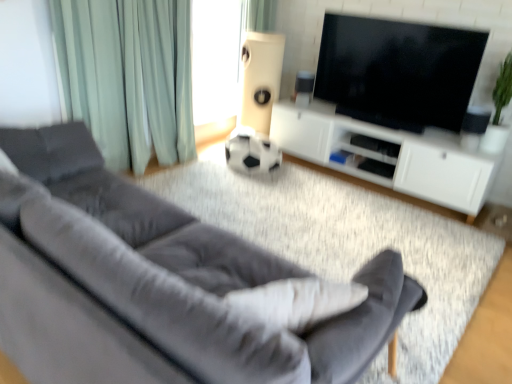
Image resolution: width=512 pixels, height=384 pixels. I want to click on free space between black glossy tv at upper center and white plastic speaker at upper center, arranged as the first speaker when viewed from the right, so click(x=350, y=120).